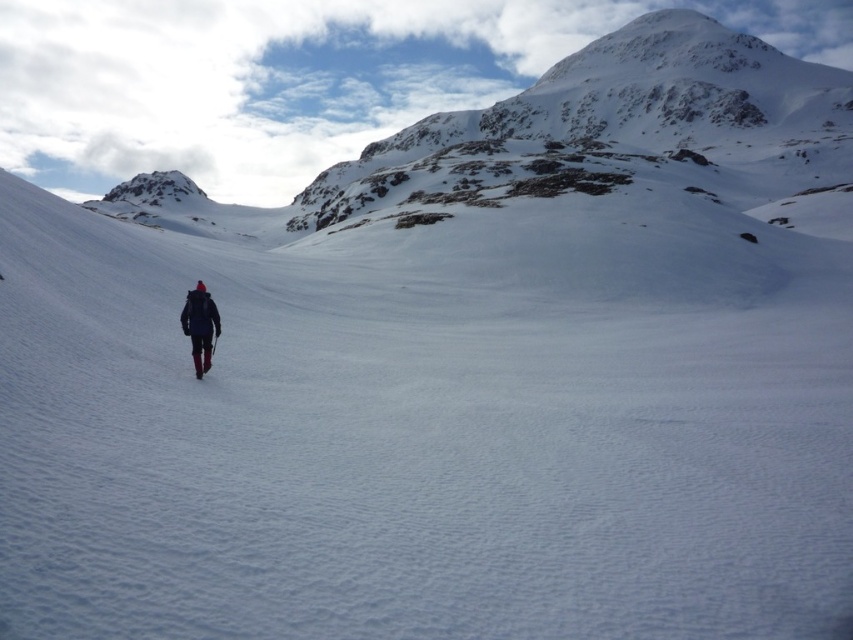
Question: Which object is farther from the camera taking this photo?

Choices:
 (A) dark blue fabric jacket at center
 (B) matte black ski at center

Answer: (A)

Question: Does dark blue fabric jacket at center have a lesser width compared to matte black ski at center?

Choices:
 (A) yes
 (B) no

Answer: (B)

Question: Which object appears closest to the camera in this image?

Choices:
 (A) dark blue fabric jacket at center
 (B) matte black ski at center

Answer: (B)

Question: Is dark blue fabric jacket at center to the left of matte black ski at center from the viewer's perspective?

Choices:
 (A) yes
 (B) no

Answer: (A)

Question: Does dark blue fabric jacket at center appear on the right side of matte black ski at center?

Choices:
 (A) yes
 (B) no

Answer: (B)